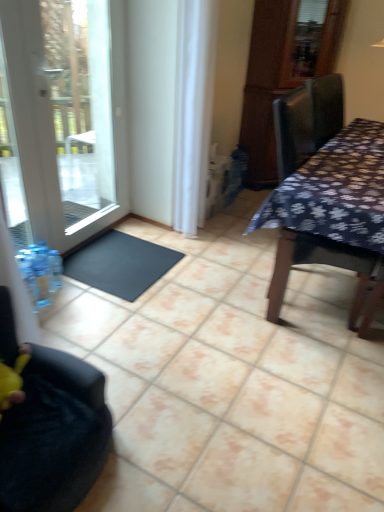
I want to click on free location in front of white sheer curtain at center, so click(196, 244).